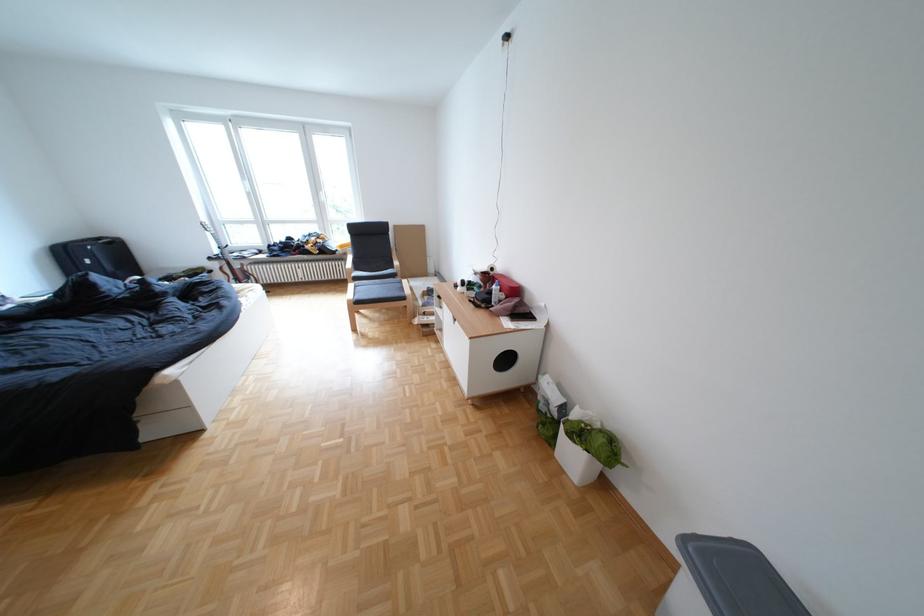
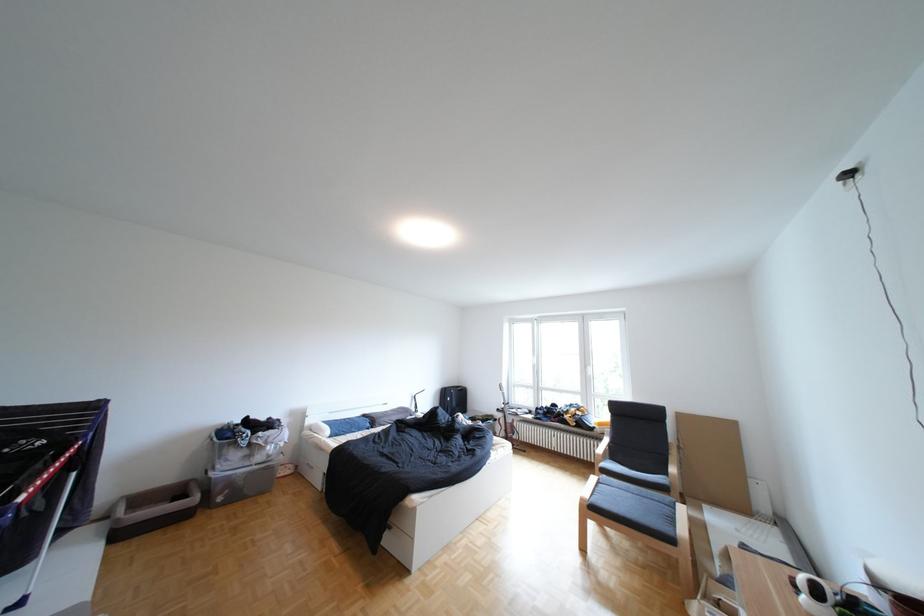
Where in the second image is the point corresponding to (x=209, y=273) from the first image?

(502, 419)